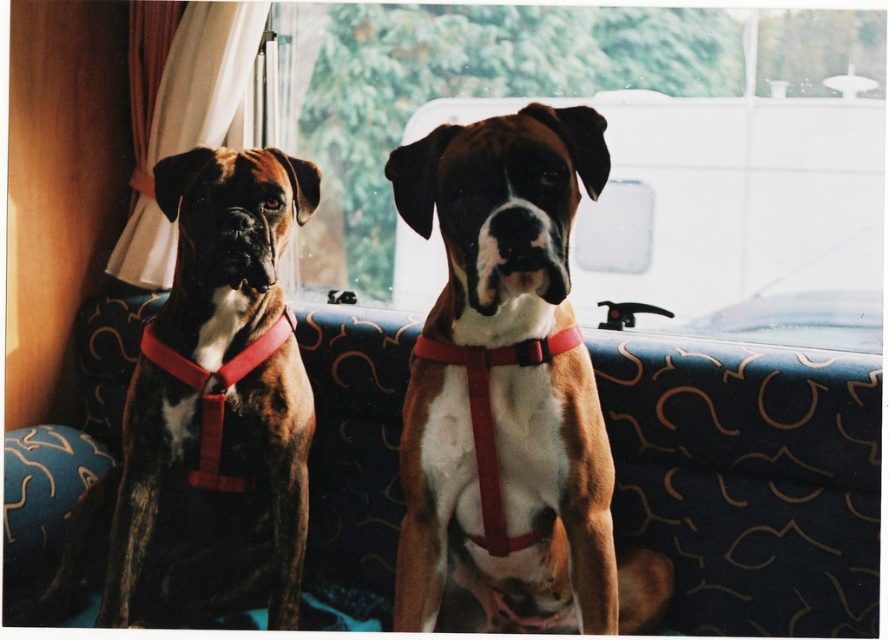
Is transparent glass window at center to the left of blue fabric couch at center from the viewer's perspective?

Indeed, transparent glass window at center is positioned on the left side of blue fabric couch at center.

This screenshot has width=889, height=640. Describe the element at coordinates (609, 145) in the screenshot. I see `transparent glass window at center` at that location.

I want to click on transparent glass window at center, so click(609, 145).

Can you confirm if blue fabric couch at center is smaller than brown brindle dog at left?

Indeed, blue fabric couch at center has a smaller size compared to brown brindle dog at left.

Is blue fabric couch at center to the left of brown brindle dog at left from the viewer's perspective?

Incorrect, blue fabric couch at center is not on the left side of brown brindle dog at left.

Which is in front, point (859, 449) or point (228, 300)?

Point (859, 449) is in front.

Where is `blue fabric couch at center`? This screenshot has height=640, width=889. blue fabric couch at center is located at coordinates (749, 477).

Who is shorter, blue fabric couch at center or brown matte dog at center?

Standing shorter between the two is blue fabric couch at center.

I want to click on blue fabric couch at center, so click(749, 477).